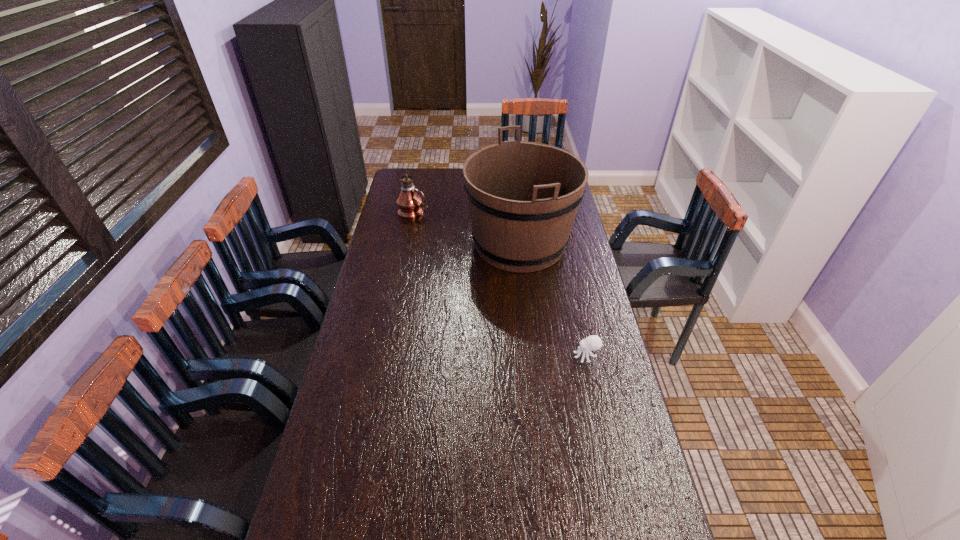
Locate an element on the screen. object present at the left edge is located at coordinates (410, 203).

At what (x,y) coordinates should I click in order to perform the action: click on bucket situated at the right edge. Please return your answer as a coordinate pair (x, y). Image resolution: width=960 pixels, height=540 pixels. Looking at the image, I should click on (523, 197).

I want to click on octopus at the right edge, so click(x=591, y=343).

In the image, there is a desktop. What are the coordinates of `free space at the left edge` in the screenshot? It's located at (383, 227).

I want to click on vacant area at the right edge of the desktop, so click(603, 449).

Identify the location of vacant point located between the shortest object and the second shortest object. coord(500,284).

Find the location of a particular element. The height and width of the screenshot is (540, 960). vacant area between the bucket and the nearest object is located at coordinates pos(553,300).

Identify the location of free space between the bucket and the leftmost object. Image resolution: width=960 pixels, height=540 pixels. (467, 227).

Locate an element on the screen. This screenshot has width=960, height=540. unoccupied area between the tallest object and the oil lamp is located at coordinates [x=467, y=227].

This screenshot has height=540, width=960. I want to click on vacant area that lies between the second tallest object and the tallest object, so [467, 227].